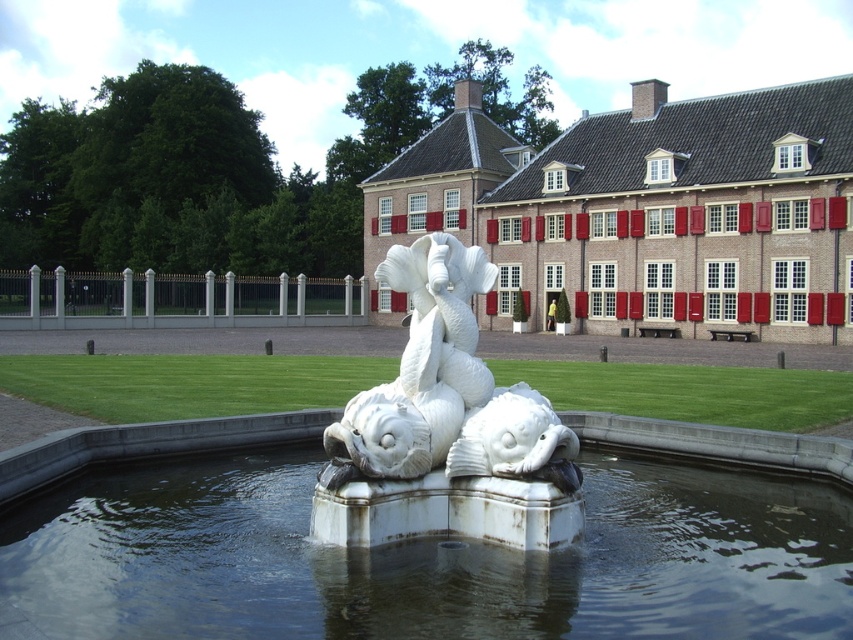
Question: Among these objects, which one is nearest to the camera?

Choices:
 (A) white marble sculpture at center
 (B) white marble fish at center
 (C) clear water at fountain center
 (D) brick red building at center

Answer: (C)

Question: Observing the image, what is the correct spatial positioning of clear water at fountain center in reference to brick red building at center?

Choices:
 (A) above
 (B) below

Answer: (B)

Question: Which point is closer to the camera taking this photo?

Choices:
 (A) (479, 461)
 (B) (509, 493)
 (C) (590, 310)
 (D) (619, 573)

Answer: (D)

Question: Which object is farther from the camera taking this photo?

Choices:
 (A) white marble sculpture at center
 (B) clear water at fountain center
 (C) brick red building at center

Answer: (C)

Question: Is brick red building at center positioned in front of white marble sculpture at center?

Choices:
 (A) no
 (B) yes

Answer: (A)

Question: Is clear water at fountain center further to the viewer compared to white marble fish at center?

Choices:
 (A) yes
 (B) no

Answer: (B)